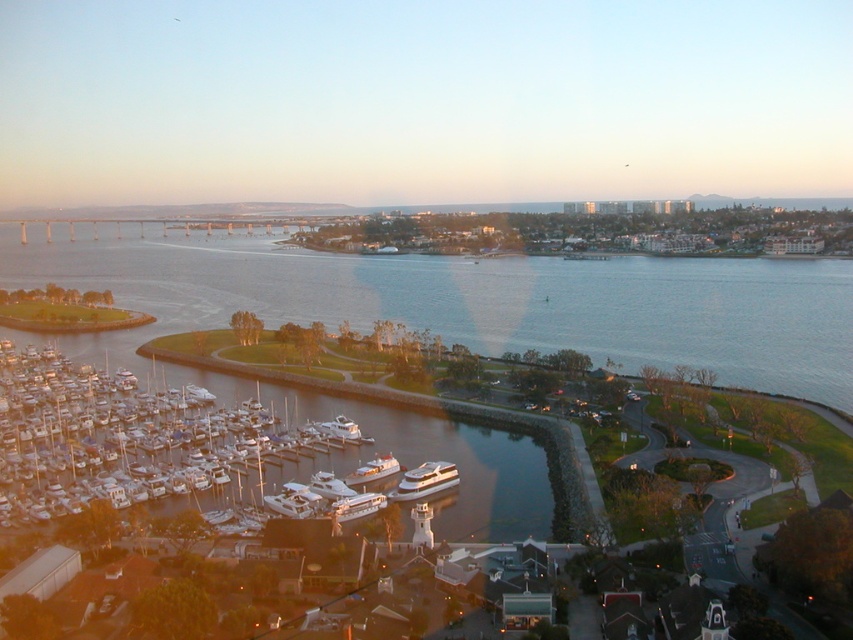
Does point (404, 480) come closer to viewer compared to point (346, 504)?

No, (404, 480) is behind (346, 504).

Is shiny white yacht at center in front of white glossy yacht at center?

No, it is behind white glossy yacht at center.

Is point (431, 492) behind point (378, 497)?

Yes.

This screenshot has width=853, height=640. Identify the location of shiny white yacht at center. (425, 481).

Is white glossy boats at lower left closer to camera compared to white glossy boat at center?

Yes.

The width and height of the screenshot is (853, 640). What do you see at coordinates (125, 436) in the screenshot?
I see `white glossy boats at lower left` at bounding box center [125, 436].

Locate an element on the screen. white glossy boats at lower left is located at coordinates (125, 436).

Does blue water at center appear on the right side of white glossy yacht at center?

Incorrect, blue water at center is not on the right side of white glossy yacht at center.

Image resolution: width=853 pixels, height=640 pixels. I want to click on blue water at center, so click(485, 300).

Identify the location of blue water at center. (485, 300).